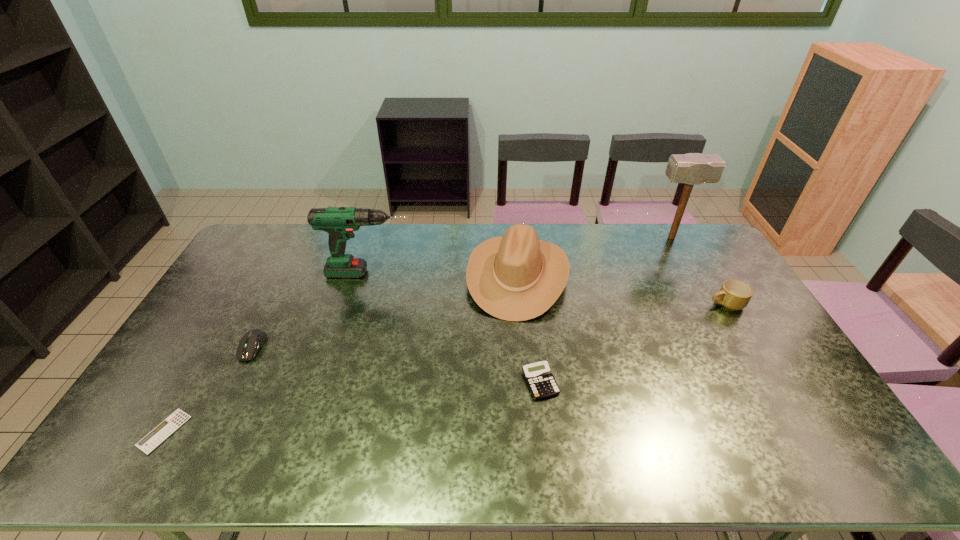
This screenshot has height=540, width=960. What are the coordinates of `vacant space in between the fifth tallest object and the leftmost object` in the screenshot? It's located at (208, 389).

Where is `blank region between the left calculator and the third tallest object`? This screenshot has height=540, width=960. blank region between the left calculator and the third tallest object is located at coordinates (341, 353).

What are the coordinates of `free space between the shortest object and the third tallest object` in the screenshot? It's located at (341, 353).

Identify the location of object that is the second nearest to the shortest object. The height and width of the screenshot is (540, 960). (340, 222).

At what (x,y) coordinates should I click in order to perform the action: click on object that is the fifth closest to the fifth farthest object. Please return your answer as a coordinate pair (x, y). Looking at the image, I should click on (692, 169).

At what (x,y) coordinates should I click in order to perform the action: click on vacant space that satisfies the following two spatial constraints: 1. on the handle side of the third object from left to right; 2. on the right side of the third tallest object. Please return your answer as a coordinate pair (x, y). The height and width of the screenshot is (540, 960). Looking at the image, I should click on (369, 275).

The image size is (960, 540). Identify the location of vacant space that satisfies the following two spatial constraints: 1. on the side with the handle of the fourth shortest object; 2. on the striking face of the tallest object. (686, 238).

Locate an element on the screen. The width and height of the screenshot is (960, 540). free location that satisfies the following two spatial constraints: 1. on the striking face of the mallet; 2. on the button of the computer equipment is located at coordinates (732, 347).

Locate an element on the screen. The width and height of the screenshot is (960, 540). vacant space that satisfies the following two spatial constraints: 1. on the side with the handle of the mug; 2. on the handle side of the second tallest object is located at coordinates (708, 273).